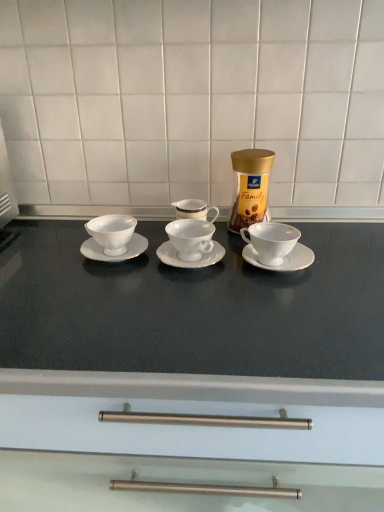
Identify the location of free spot in front of white porcelain saucer at center, marked as the 2th saucer in a right-to-left arrangement. The height and width of the screenshot is (512, 384). (193, 302).